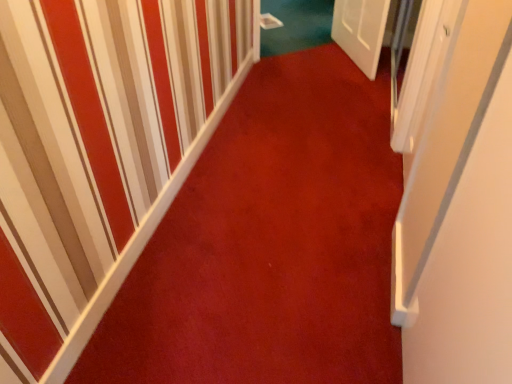
Image resolution: width=512 pixels, height=384 pixels. What do you see at coordinates (422, 69) in the screenshot?
I see `white glossy door at right` at bounding box center [422, 69].

This screenshot has height=384, width=512. What are the coordinates of `white glossy door at right` in the screenshot? It's located at (422, 69).

What are the coordinates of `white glossy door at right` in the screenshot? It's located at (422, 69).